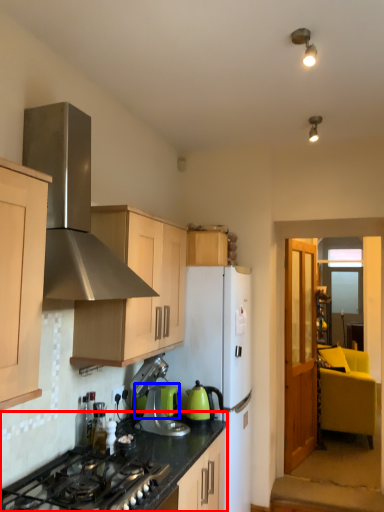
Question: Which of the following is the farthest to the observer, countertop (highlighted by a red box) or appliance (highlighted by a blue box)?

Choices:
 (A) countertop
 (B) appliance

Answer: (B)